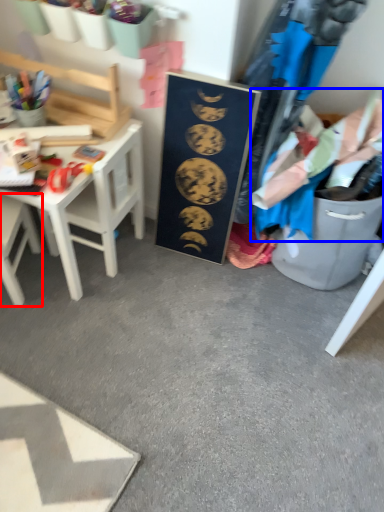
Question: Which object appears closest to the camera in this image, chair (highlighted by a red box) or clothing (highlighted by a blue box)?

Choices:
 (A) chair
 (B) clothing

Answer: (B)